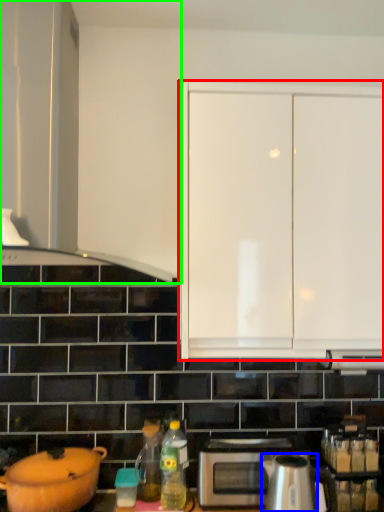
Question: Which is nearer to the cabinetry (highlighted by a red box)? kitchen appliance (highlighted by a blue box) or cabinetry (highlighted by a green box).

Choices:
 (A) kitchen appliance
 (B) cabinetry

Answer: (B)